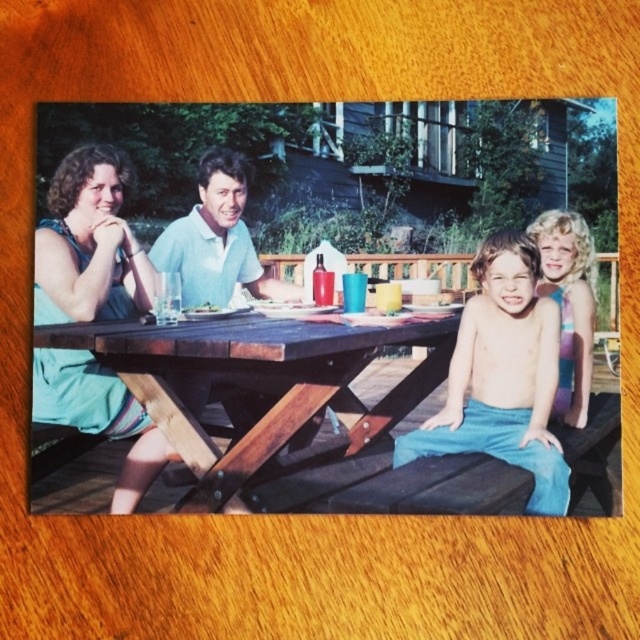
Which is below, brown wooden table at center or blonde hair at right?

brown wooden table at center

Does brown wooden table at center have a greater width compared to blonde hair at right?

Indeed, brown wooden table at center has a greater width compared to blonde hair at right.

Does point (106, 324) come behind point (579, 288)?

Yes, point (106, 324) is farther from viewer.

The height and width of the screenshot is (640, 640). I want to click on brown wooden table at center, so point(262,381).

Is wooden picnic table at center above teal fabric dress at left?

Correct, wooden picnic table at center is located above teal fabric dress at left.

Measure the distance between wooden picnic table at center and camera.

They are 1.23 meters apart.

Identify the location of wooden picnic table at center. (138, 243).

Can you confirm if teal fabric dress at left is positioned below blonde hair at right?

Yes.

Between teal fabric dress at left and blonde hair at right, which one has more height?

teal fabric dress at left is taller.

Which is behind, point (86, 387) or point (547, 211)?

Positioned behind is point (86, 387).

At what (x,y) coordinates should I click in order to perform the action: click on teal fabric dress at left. Please return your answer as a coordinate pair (x, y). This screenshot has width=640, height=640. Looking at the image, I should click on (90, 243).